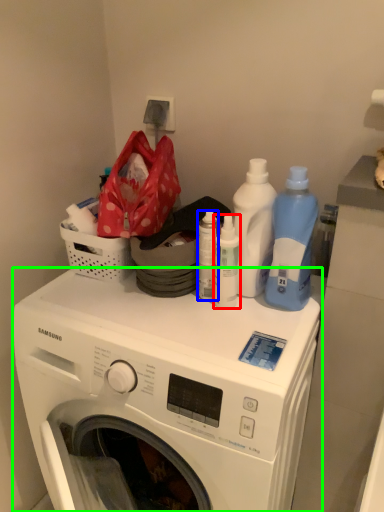
Question: Estimate the real-world distances between objects in this image. Which object is farther from cleaning product (highlighted by a red box), bottle (highlighted by a blue box) or washing machine (highlighted by a green box)?

Choices:
 (A) bottle
 (B) washing machine

Answer: (B)